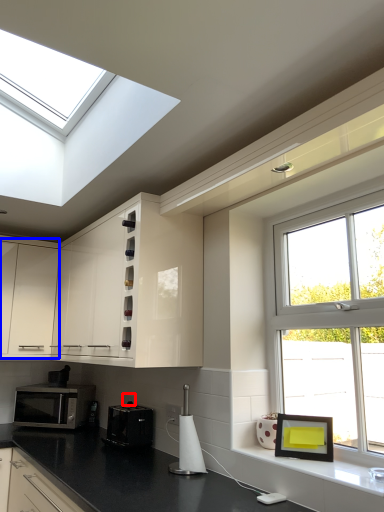
Question: Among these objects, which one is farthest to the camera, electric outlet (highlighted by a red box) or cabinetry (highlighted by a blue box)?

Choices:
 (A) electric outlet
 (B) cabinetry

Answer: (B)